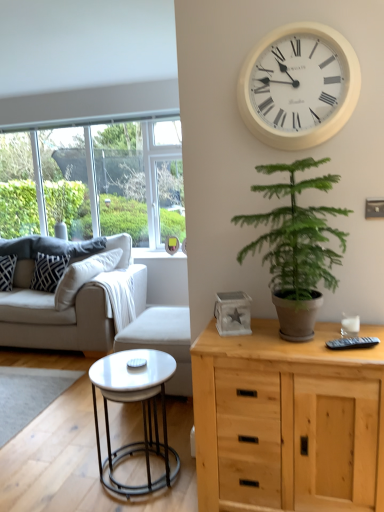
Question: Can beige fabric couch at left be found inside white plastic wall clock at upper center?

Choices:
 (A) yes
 (B) no

Answer: (B)

Question: Is white plastic wall clock at upper center positioned with its back to beige fabric couch at left?

Choices:
 (A) yes
 (B) no

Answer: (B)

Question: Is white plastic wall clock at upper center further to camera compared to beige fabric couch at left?

Choices:
 (A) no
 (B) yes

Answer: (A)

Question: Is white plastic wall clock at upper center shorter than beige fabric couch at left?

Choices:
 (A) no
 (B) yes

Answer: (B)

Question: Is white plastic wall clock at upper center located outside beige fabric couch at left?

Choices:
 (A) yes
 (B) no

Answer: (A)

Question: Does white plastic wall clock at upper center have a lesser width compared to beige fabric couch at left?

Choices:
 (A) yes
 (B) no

Answer: (A)

Question: From the image's perspective, is white glossy coffee table at lower left located above green leafy plant at center-right?

Choices:
 (A) no
 (B) yes

Answer: (A)

Question: Can you confirm if white glossy coffee table at lower left is positioned to the left of green leafy plant at center-right?

Choices:
 (A) no
 (B) yes

Answer: (B)

Question: From a real-world perspective, is white glossy coffee table at lower left beneath green leafy plant at center-right?

Choices:
 (A) yes
 (B) no

Answer: (A)

Question: Considering the relative sizes of white glossy coffee table at lower left and green leafy plant at center-right in the image provided, is white glossy coffee table at lower left smaller than green leafy plant at center-right?

Choices:
 (A) yes
 (B) no

Answer: (A)

Question: Considering the relative sizes of white glossy coffee table at lower left and green leafy plant at center-right in the image provided, is white glossy coffee table at lower left bigger than green leafy plant at center-right?

Choices:
 (A) no
 (B) yes

Answer: (A)

Question: Is the depth of white glossy coffee table at lower left less than that of green leafy plant at center-right?

Choices:
 (A) no
 (B) yes

Answer: (A)

Question: Does white fabric armchair at center turn towards patterned fabric pillow at left, placed as the 1th pillow when sorted from left to right?

Choices:
 (A) no
 (B) yes

Answer: (B)